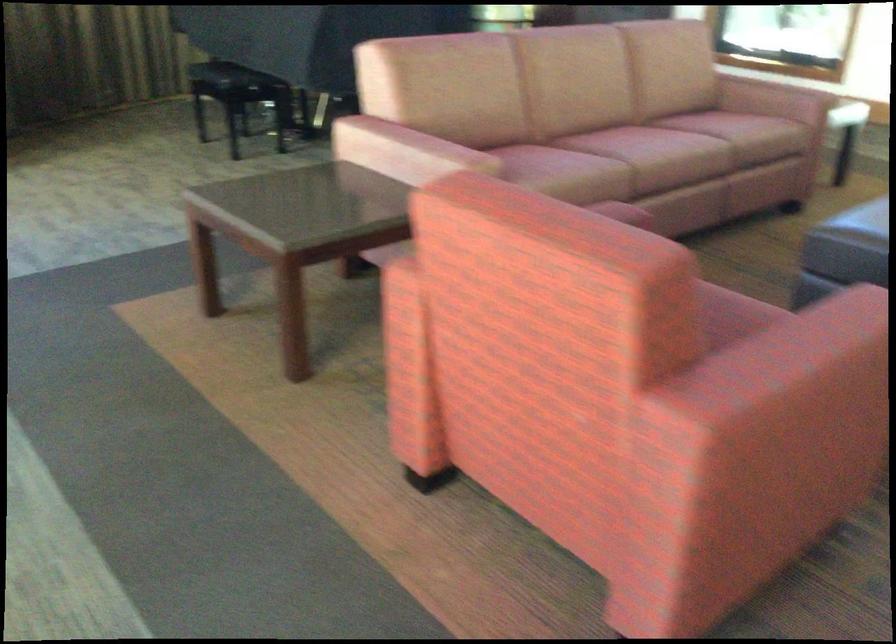
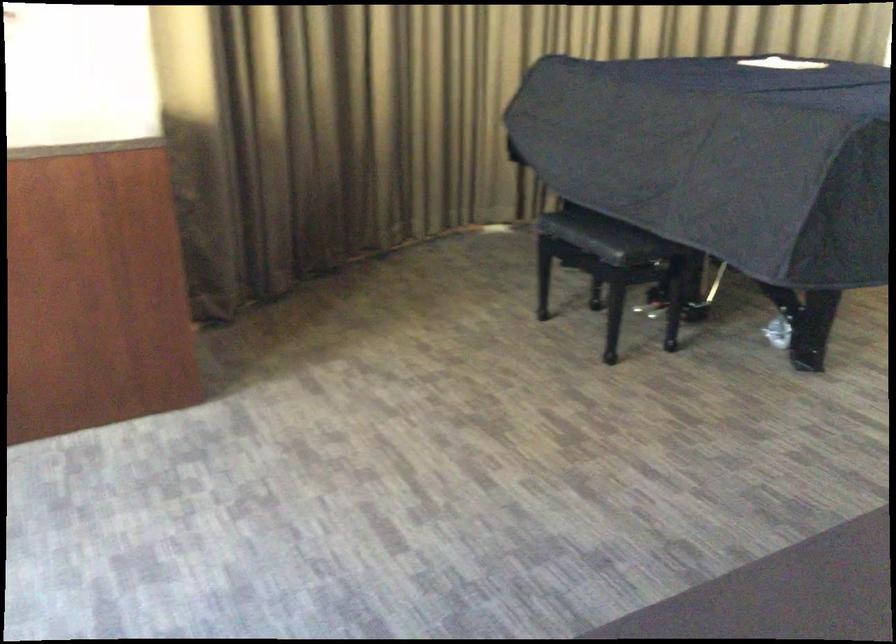
The images are taken continuously from a first-person perspective. In which direction are you moving?

The cameraman walked toward left, forward.